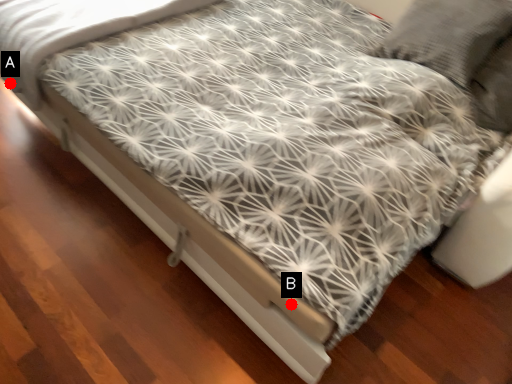
Question: Two points are circled on the image, labeled by A and B beside each circle. Which point is closer to the camera?

Choices:
 (A) A is closer
 (B) B is closer

Answer: (B)